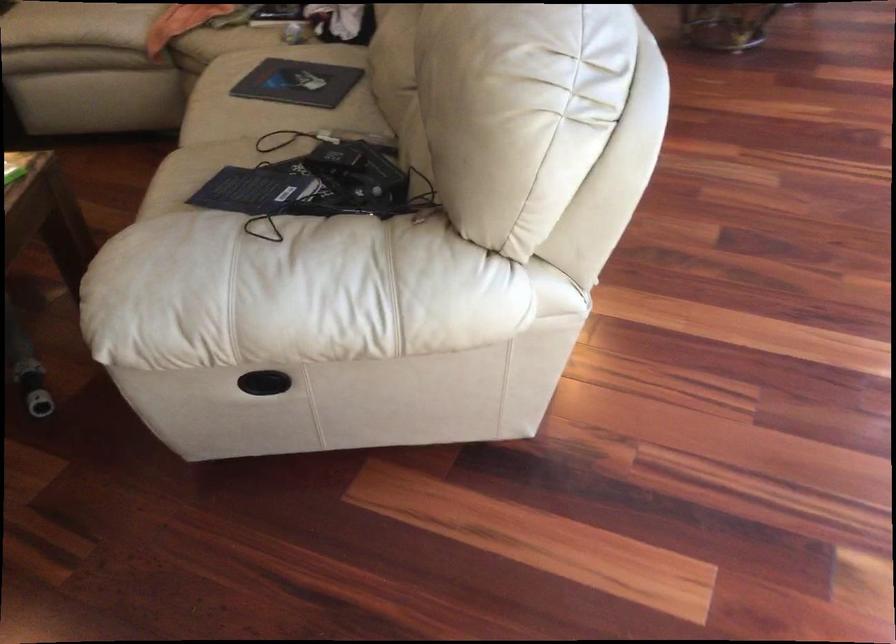
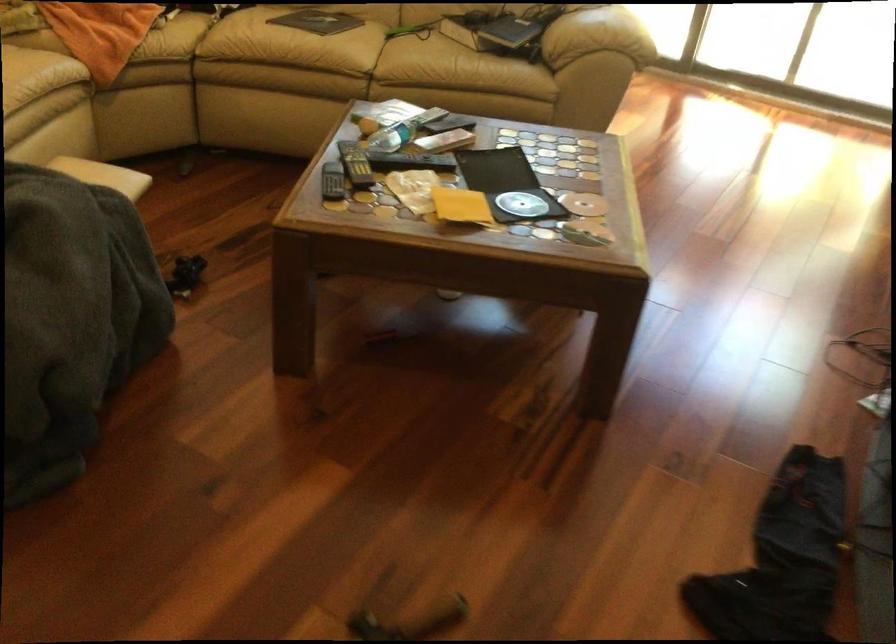
Find the pixel in the second image that matches [306,192] in the first image.

(510, 31)